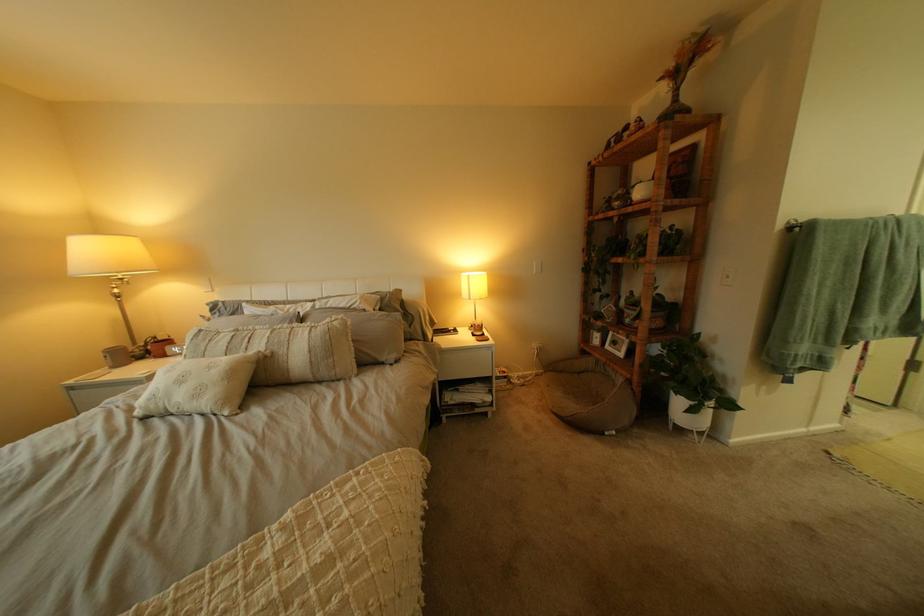
Identify the location of dark decorative vase. (684, 70).